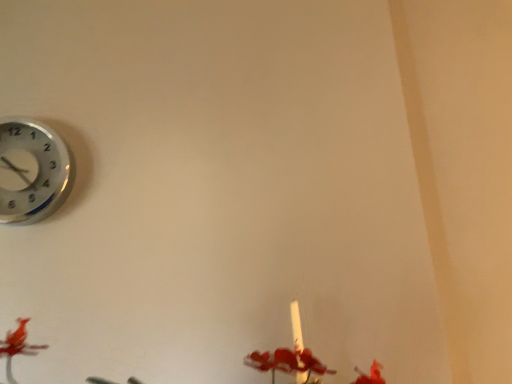
Describe the element at coordinates (32, 171) in the screenshot. I see `metallic silver clock at upper left` at that location.

At what (x,y) coordinates should I click in order to perform the action: click on metallic silver clock at upper left. Please return your answer as a coordinate pair (x, y). Image resolution: width=512 pixels, height=384 pixels. Looking at the image, I should click on (32, 171).

Identify the location of metallic silver clock at upper left. The height and width of the screenshot is (384, 512). (32, 171).